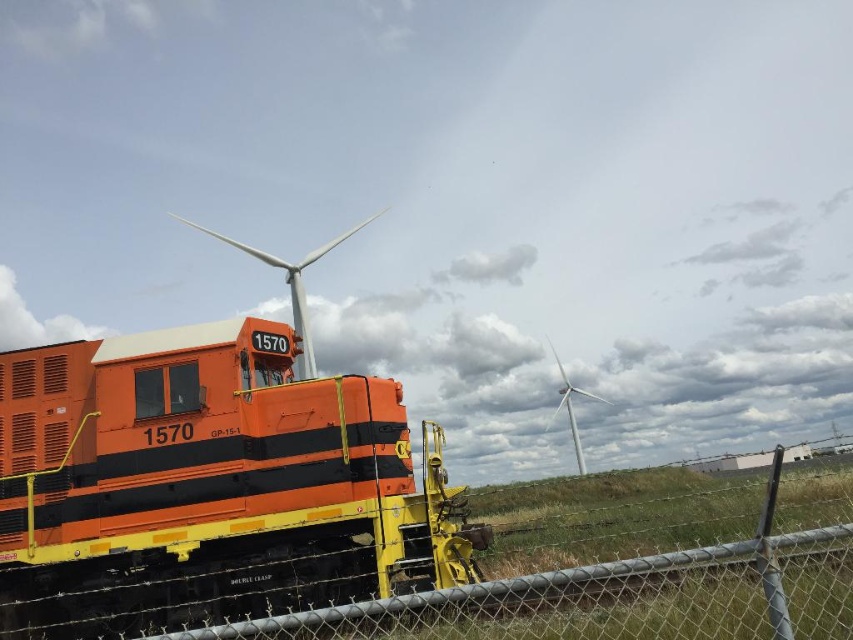
Question: Is orange matte train at center above metal chain-link fence at lower right?

Choices:
 (A) yes
 (B) no

Answer: (A)

Question: Does orange matte train at center have a lesser width compared to metal chain-link fence at lower right?

Choices:
 (A) no
 (B) yes

Answer: (A)

Question: Does white matte wind turbine at upper center come behind white metallic wind turbine at center?

Choices:
 (A) yes
 (B) no

Answer: (B)

Question: Which object appears farthest from the camera in this image?

Choices:
 (A) metal chain-link fence at lower right
 (B) white matte wind turbine at upper center
 (C) white metallic wind turbine at center
 (D) orange matte train at center

Answer: (C)

Question: Which object is the closest to the white matte wind turbine at upper center?

Choices:
 (A) metal chain-link fence at lower right
 (B) orange matte train at center
 (C) white metallic wind turbine at center

Answer: (B)

Question: Which of the following is the closest to the observer?

Choices:
 (A) (271, 368)
 (B) (573, 420)

Answer: (A)